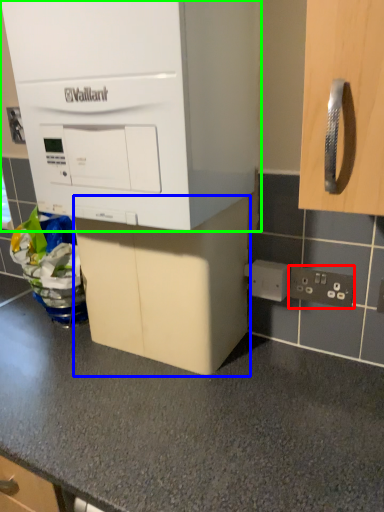
Question: Based on their relative distances, which object is nearer to electric outlet (highlighted by a red box)? Choose from cabinetry (highlighted by a blue box) and cabinetry (highlighted by a green box).

Choices:
 (A) cabinetry
 (B) cabinetry

Answer: (A)